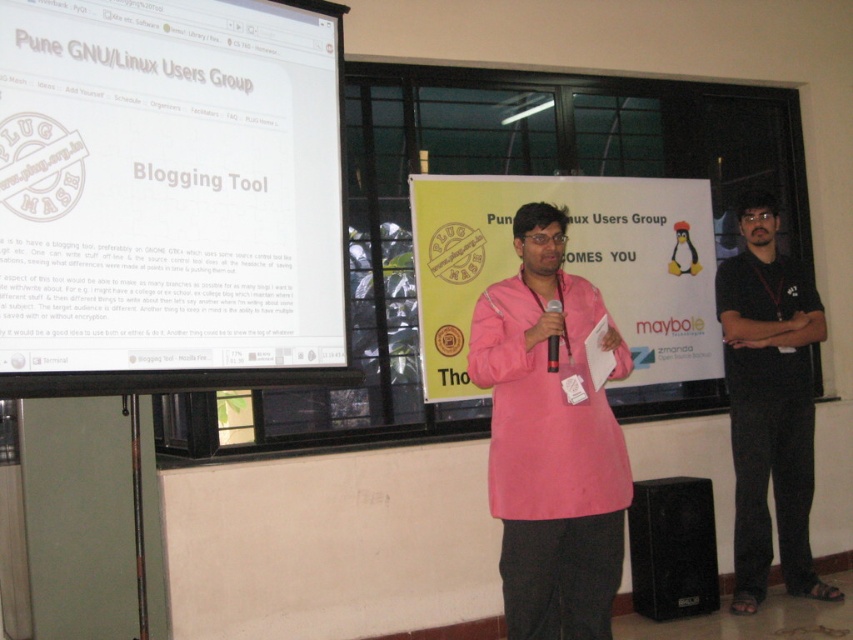
Question: Based on their relative distances, which object is nearer to the black cotton shirt at right?

Choices:
 (A) black matte microphone at center
 (B) pink fabric kurta at center

Answer: (B)

Question: Which object is farther from the camera taking this photo?

Choices:
 (A) pink fabric kurta at center
 (B) black cotton shirt at right

Answer: (B)

Question: Estimate the real-world distances between objects in this image. Which object is farther from the black matte microphone at center?

Choices:
 (A) pink fabric kurta at center
 (B) black cotton shirt at right

Answer: (B)

Question: Can you confirm if pink fabric kurta at center is wider than black matte microphone at center?

Choices:
 (A) yes
 (B) no

Answer: (A)

Question: Can you confirm if white glossy projector screen at upper left is bigger than black matte microphone at center?

Choices:
 (A) yes
 (B) no

Answer: (A)

Question: Does white glossy projector screen at upper left appear on the right side of black cotton shirt at right?

Choices:
 (A) yes
 (B) no

Answer: (B)